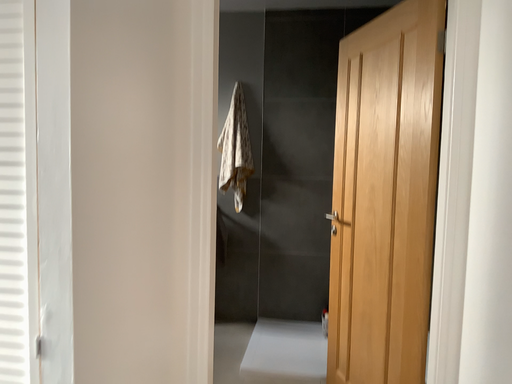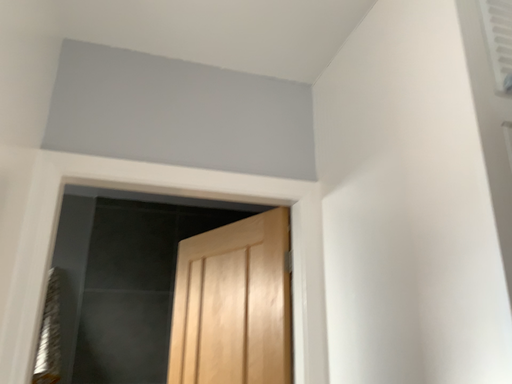
Question: Which way did the camera rotate in the video?

Choices:
 (A) rotated left
 (B) rotated right

Answer: (B)